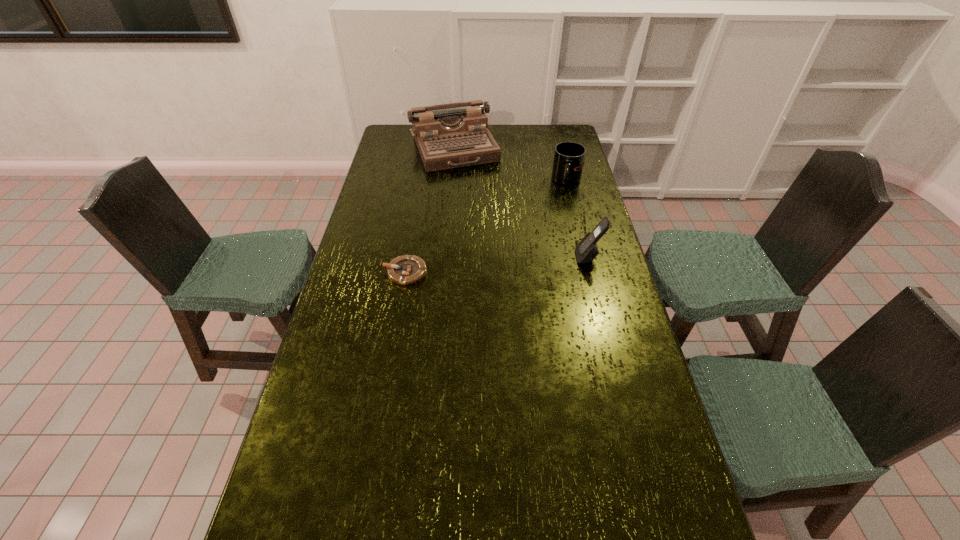
Identify the location of vacant space situated 0.120m with the handle on the side of the mug. This screenshot has height=540, width=960. (553, 206).

You are a GUI agent. You are given a task and a screenshot of the screen. Output one action in this format:
    pyautogui.click(x=<x>, y=<y>)
    Task: Click on the vacant region located 0.310m on the keyboard of the typewriter
    This screenshot has height=540, width=960.
    Given the screenshot: What is the action you would take?
    pyautogui.click(x=485, y=212)

Where is `free spot located 0.170m on the keyboard of the typewriter`? This screenshot has width=960, height=540. free spot located 0.170m on the keyboard of the typewriter is located at coordinates (475, 193).

The height and width of the screenshot is (540, 960). I want to click on free space located on the keyboard of the typewriter, so click(475, 193).

At what (x,y) coordinates should I click in order to perform the action: click on object located in the far edge section of the desktop. Please return your answer as a coordinate pair (x, y). Looking at the image, I should click on (452, 135).

At what (x,y) coordinates should I click in order to perform the action: click on ashtray that is at the left edge. Please return your answer as a coordinate pair (x, y). This screenshot has height=540, width=960. Looking at the image, I should click on (404, 270).

Find the location of a particular element. This screenshot has height=540, width=960. typewriter situated at the left edge is located at coordinates (452, 135).

I want to click on cellular telephone that is at the right edge, so click(586, 250).

Find the location of `mug present at the right edge`. mug present at the right edge is located at coordinates (568, 162).

Where is `object at the far left corner`? object at the far left corner is located at coordinates (452, 135).